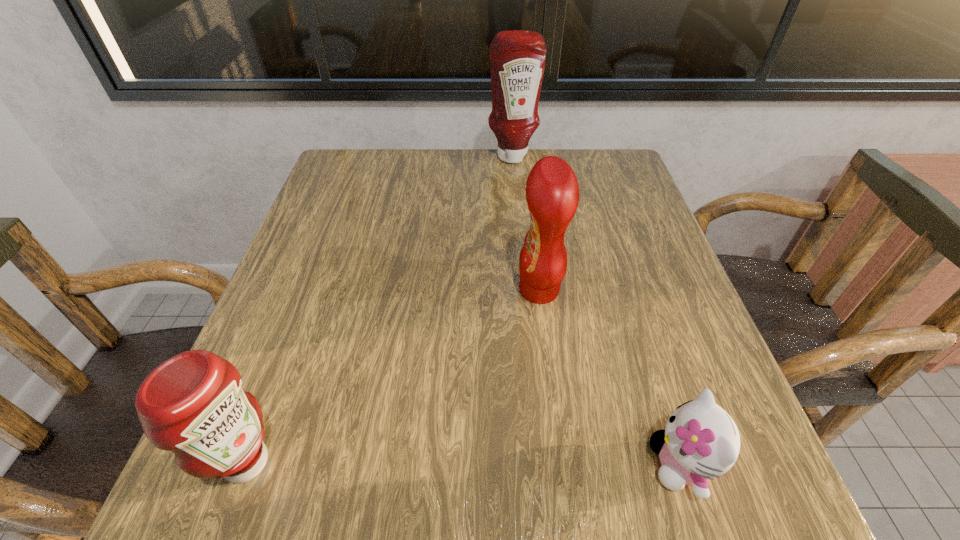
Find the location of a particular element. the closest object to the leftmost condiment is located at coordinates (552, 193).

Locate an element on the screen. This screenshot has height=540, width=960. the closest condiment relative to the nearest condiment is located at coordinates [x=552, y=193].

At what (x,y) coordinates should I click in order to perform the action: click on condiment that is the second closest to the leftmost object. Please return your answer as a coordinate pair (x, y). This screenshot has height=540, width=960. Looking at the image, I should click on (517, 58).